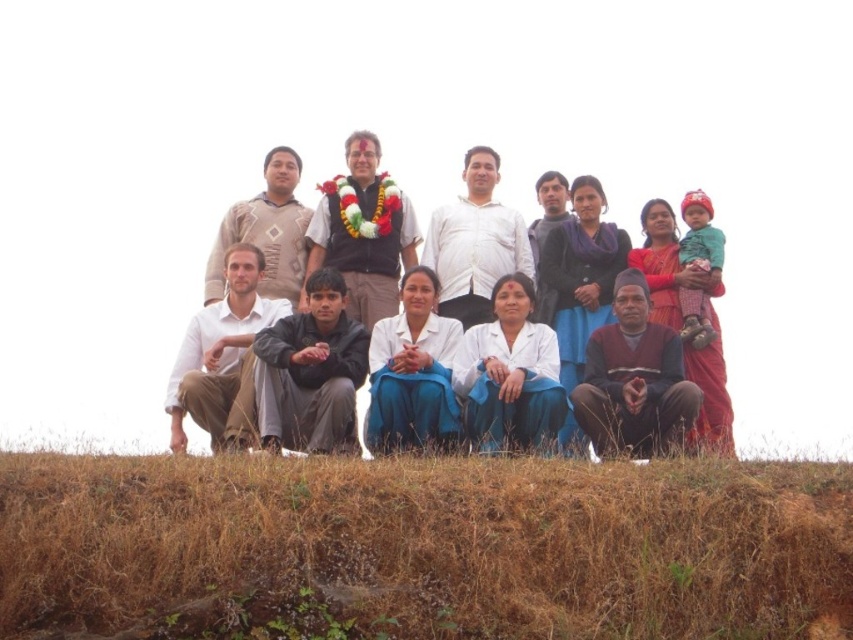
Who is higher up, dark gray jacket at center or white shirt at center?

Positioned higher is white shirt at center.

Is dark gray jacket at center shorter than white shirt at center?

Correct, dark gray jacket at center is not as tall as white shirt at center.

Is point (315, 275) closer to camera compared to point (485, 170)?

Yes, point (315, 275) is in front of point (485, 170).

I want to click on dark gray jacket at center, so click(x=310, y=371).

Is white cotton shirt at center thinner than white shirt at center?

In fact, white cotton shirt at center might be wider than white shirt at center.

Does white cotton shirt at center lie in front of white shirt at center?

Yes, it is.

I want to click on white cotton shirt at center, so click(x=610, y=260).

Locate an element on the screen. This screenshot has height=640, width=853. white cotton shirt at center is located at coordinates (610, 260).

Does dark gray jacket at center have a greater height compared to matte black shirt at center?

Incorrect, dark gray jacket at center's height is not larger of matte black shirt at center's.

Can you confirm if dark gray jacket at center is wider than matte black shirt at center?

Incorrect, dark gray jacket at center's width does not surpass matte black shirt at center's.

The height and width of the screenshot is (640, 853). I want to click on dark gray jacket at center, so click(310, 371).

Where is `dark gray jacket at center`? dark gray jacket at center is located at coordinates click(x=310, y=371).